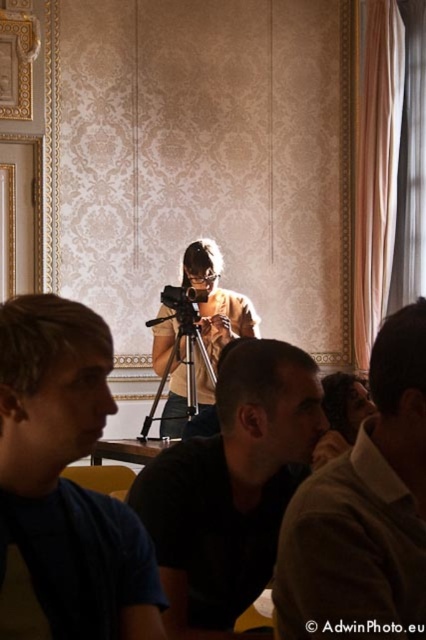
Question: Does matte yellow shirt at center have a lesser width compared to silver metallic tripod at center?

Choices:
 (A) yes
 (B) no

Answer: (A)

Question: Does blue cotton shirt at lower left appear on the right side of black plastic video camera at center?

Choices:
 (A) no
 (B) yes

Answer: (A)

Question: Which object appears farthest from the camera in this image?

Choices:
 (A) silver metallic tripod at center
 (B) matte yellow shirt at center

Answer: (B)

Question: From the image, what is the correct spatial relationship of dark brown leather jacket at center in relation to matte yellow shirt at center?

Choices:
 (A) right
 (B) left

Answer: (A)

Question: Which is nearer to the dark brown leather jacket at center?

Choices:
 (A) matte yellow shirt at center
 (B) silver metallic tripod at center
 (C) blue cotton shirt at lower left
 (D) black matte tripod at center

Answer: (D)

Question: Which point is farther from the camera taking this photo?

Choices:
 (A) (48, 468)
 (B) (206, 358)
 (C) (232, 545)
 (D) (215, 269)

Answer: (D)